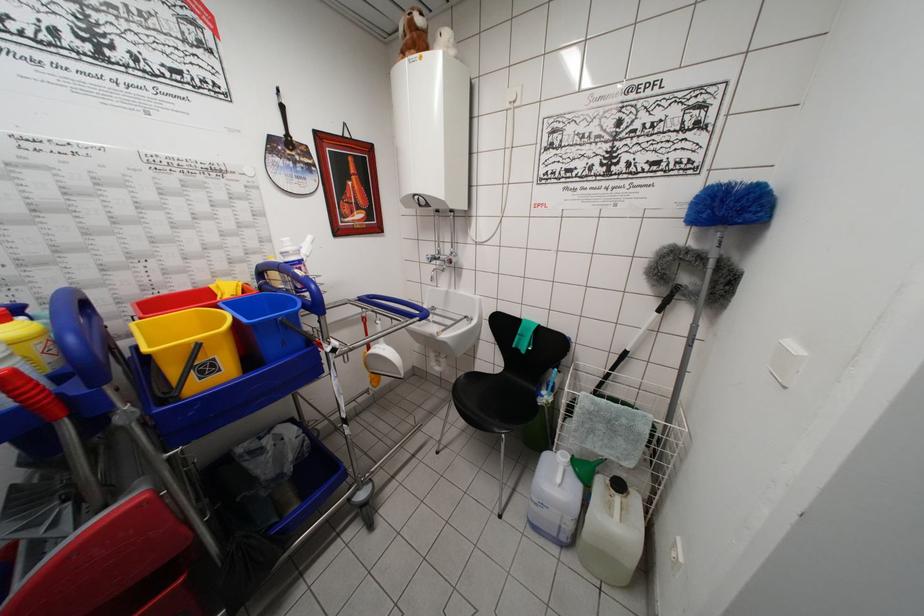
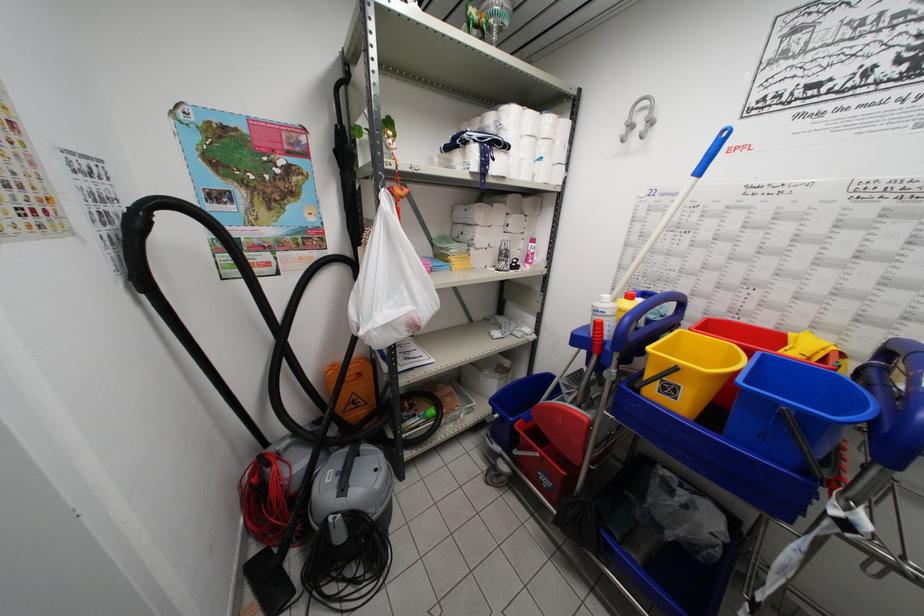
The first image is from the beginning of the video and the second image is from the end. How did the camera likely rotate when shooting the video?

The camera rotated toward left-down.